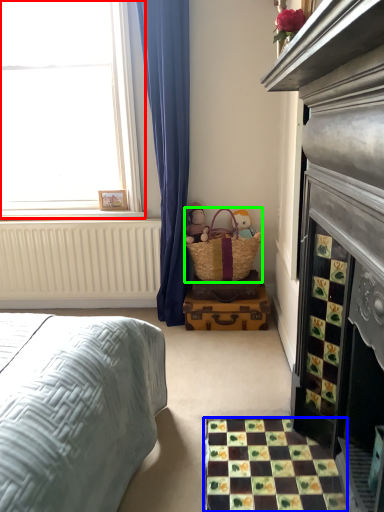
Question: Which is farther away from window (highlighted by a red box)? tile (highlighted by a blue box) or picnic basket (highlighted by a green box)?

Choices:
 (A) tile
 (B) picnic basket

Answer: (A)